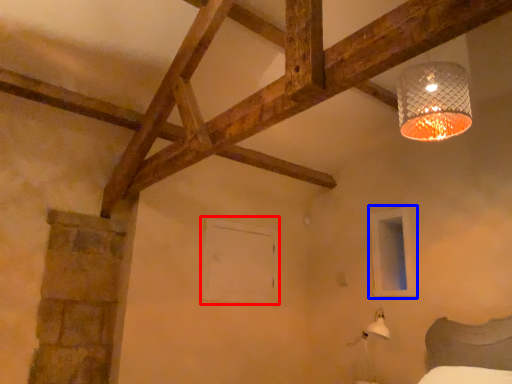
Question: Among these objects, which one is farthest to the camera, window frame (highlighted by a red box) or window frame (highlighted by a blue box)?

Choices:
 (A) window frame
 (B) window frame

Answer: (A)